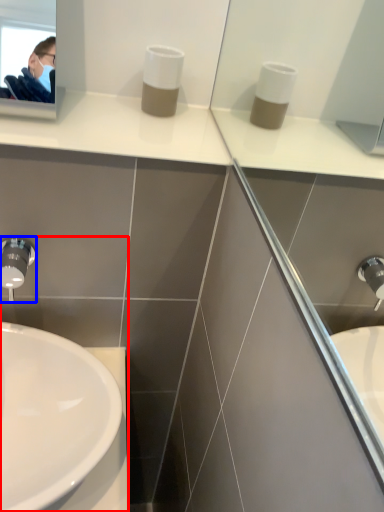
Question: Among these objects, which one is farthest to the camera, sink (highlighted by a red box) or tap (highlighted by a blue box)?

Choices:
 (A) sink
 (B) tap

Answer: (B)